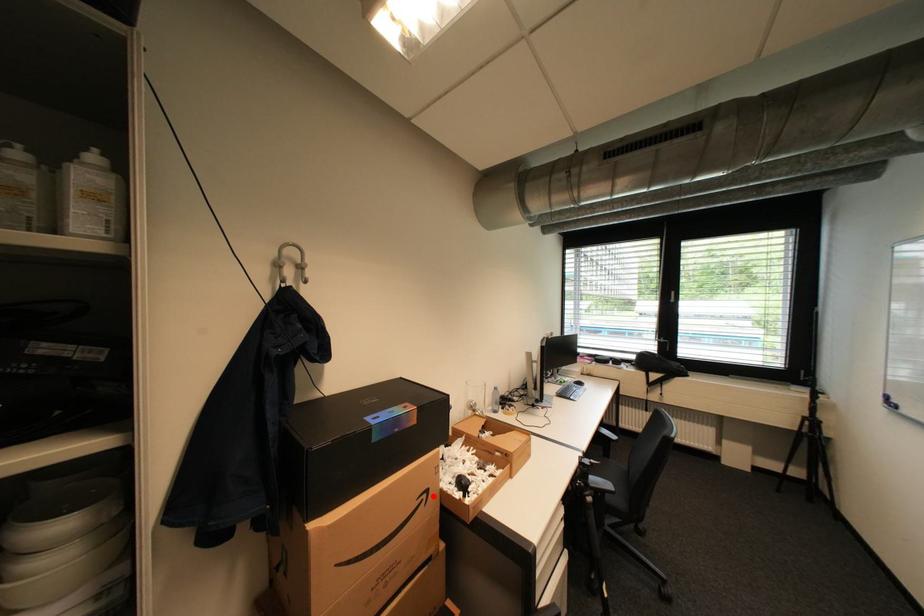
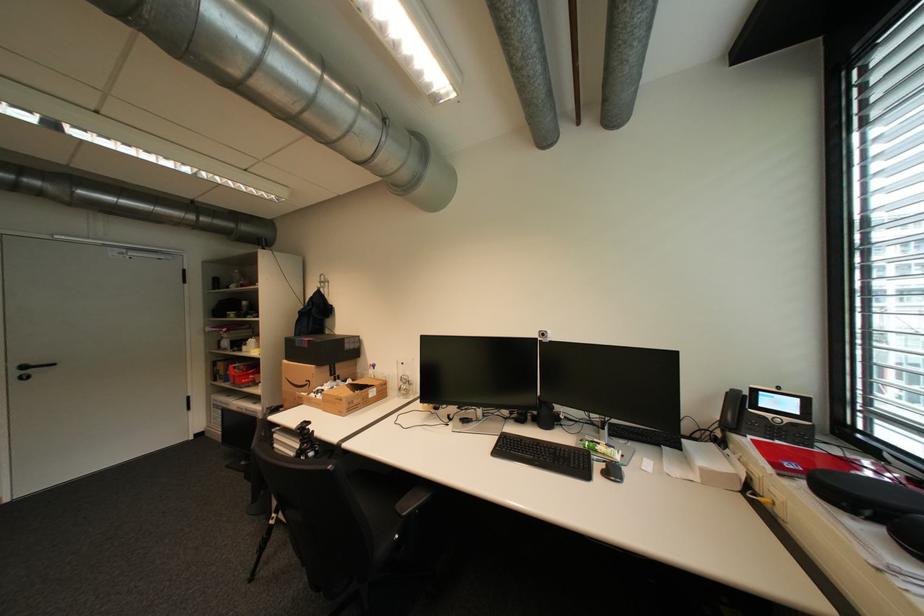
Locate, in the second image, the point that corresponds to the highlighted location in the first image.

(317, 383)